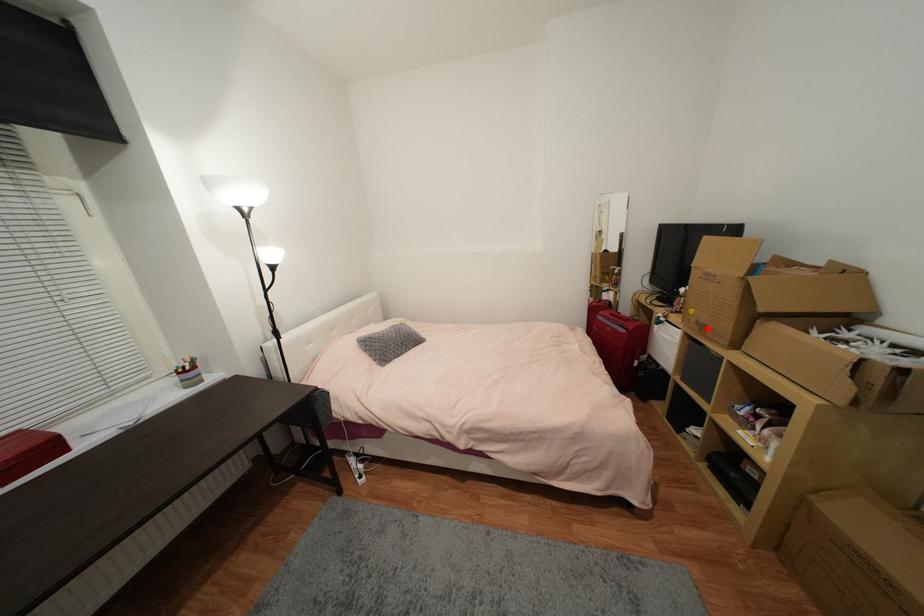
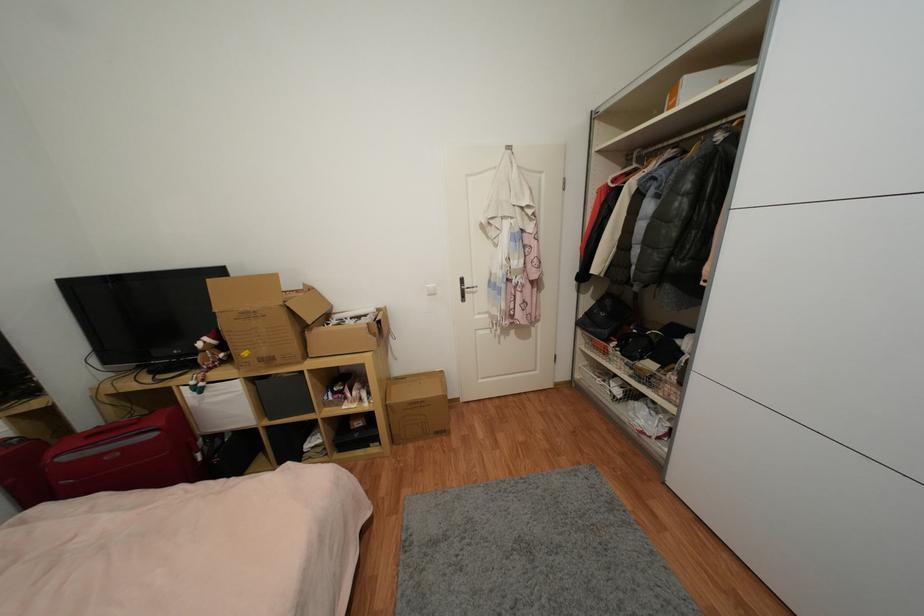
Question: I am providing you with two images of the same scene from different viewpoints. Image1 has a red point marked. In image2, the corresponding 3D location appears at what relative position? Reply with the corresponding letter.

Choices:
 (A) Closer
 (B) Farther

Answer: (B)